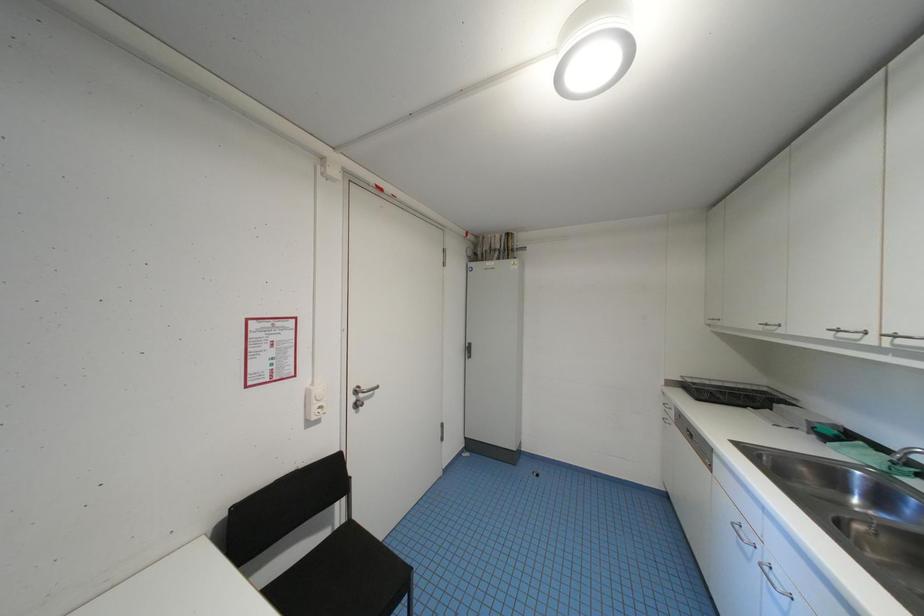
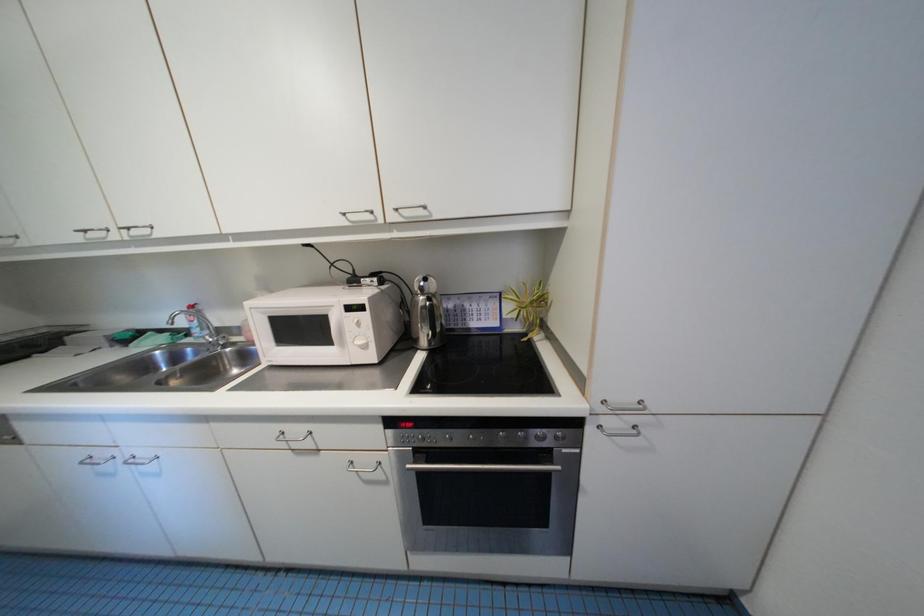
The first image is from the beginning of the video and the second image is from the end. How did the camera likely rotate when shooting the video?

The camera rotated toward right-down.